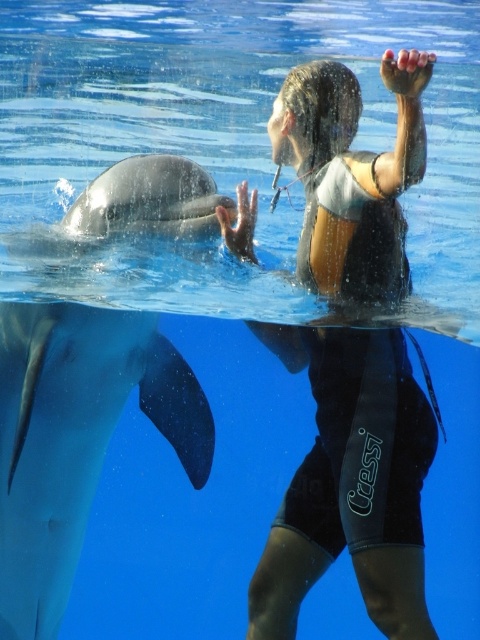
Question: Does black neoprene wetsuit at upper center appear on the left side of gray smooth dolphin at left?

Choices:
 (A) yes
 (B) no

Answer: (B)

Question: Does black neoprene wetsuit at upper center appear under smooth gray dolphin at left?

Choices:
 (A) no
 (B) yes

Answer: (A)

Question: Which of the following is the farthest from the observer?

Choices:
 (A) gray smooth dolphin at left
 (B) black neoprene wetsuit at upper center

Answer: (A)

Question: Which object is farther from the camera taking this photo?

Choices:
 (A) black neoprene wetsuit at upper center
 (B) gray smooth dolphin at left
 (C) smooth gray dolphin at left

Answer: (C)

Question: Which object is the closest to the smooth gray dolphin at left?

Choices:
 (A) black neoprene wetsuit at upper center
 (B) gray smooth dolphin at left

Answer: (B)

Question: Does black neoprene wetsuit at upper center come in front of smooth gray dolphin at left?

Choices:
 (A) yes
 (B) no

Answer: (A)